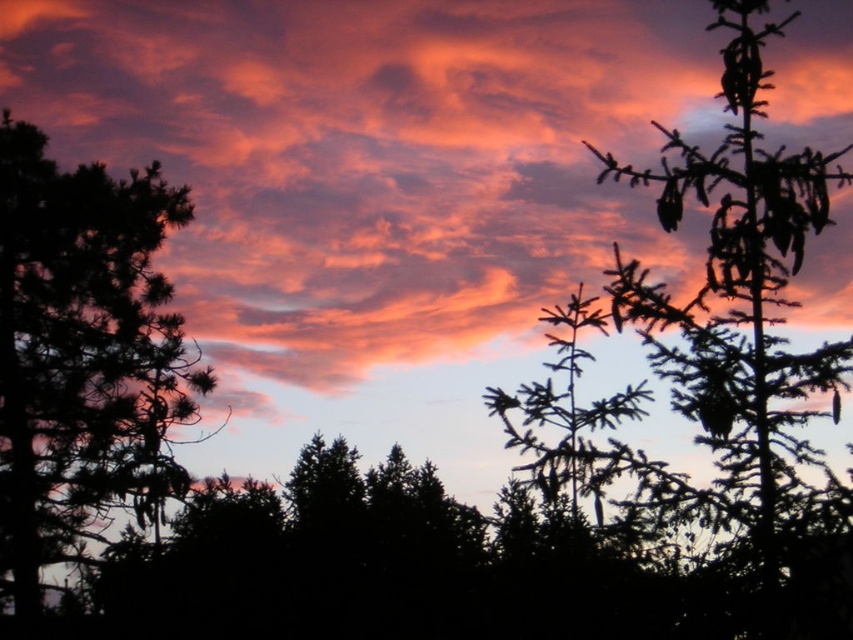
Question: Which object is the closest to the silhouette pine at right?

Choices:
 (A) silhouette tree at left
 (B) orange cotton cloud at upper center

Answer: (B)

Question: Considering the relative positions of orange cotton cloud at upper center and silhouette pine at right in the image provided, where is orange cotton cloud at upper center located with respect to silhouette pine at right?

Choices:
 (A) left
 (B) right

Answer: (A)

Question: Which point appears farthest from the camera in this image?

Choices:
 (A) (798, 417)
 (B) (352, 296)

Answer: (B)

Question: Can you confirm if silhouette tree at left is bigger than silhouette pine at right?

Choices:
 (A) no
 (B) yes

Answer: (B)

Question: Is orange cotton cloud at upper center wider than silhouette tree at left?

Choices:
 (A) no
 (B) yes

Answer: (B)

Question: Which object is positioned farthest from the silhouette tree at left?

Choices:
 (A) orange cotton cloud at upper center
 (B) silhouette pine at right

Answer: (B)